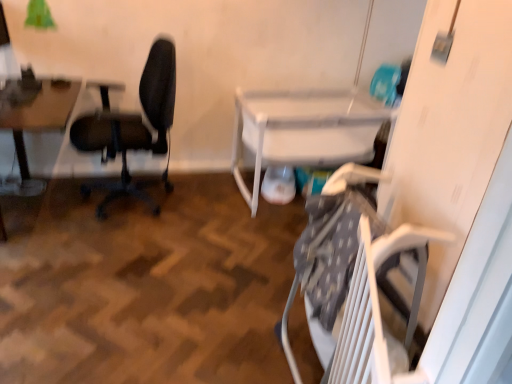
This screenshot has width=512, height=384. In order to click on vacant area situated below black matte office chair at left (from a real-world perspective) in this screenshot , I will do `click(128, 206)`.